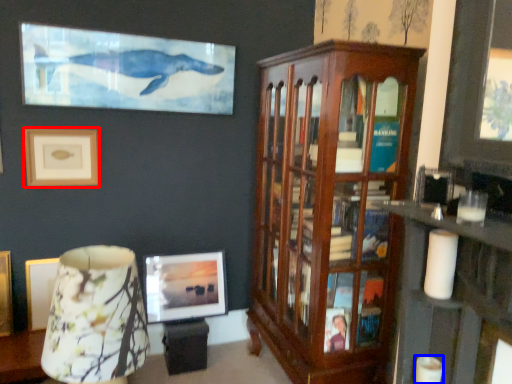
Question: Among these objects, which one is nearest to the camera, picture frame (highlighted by a red box) or candle (highlighted by a blue box)?

Choices:
 (A) picture frame
 (B) candle

Answer: (B)